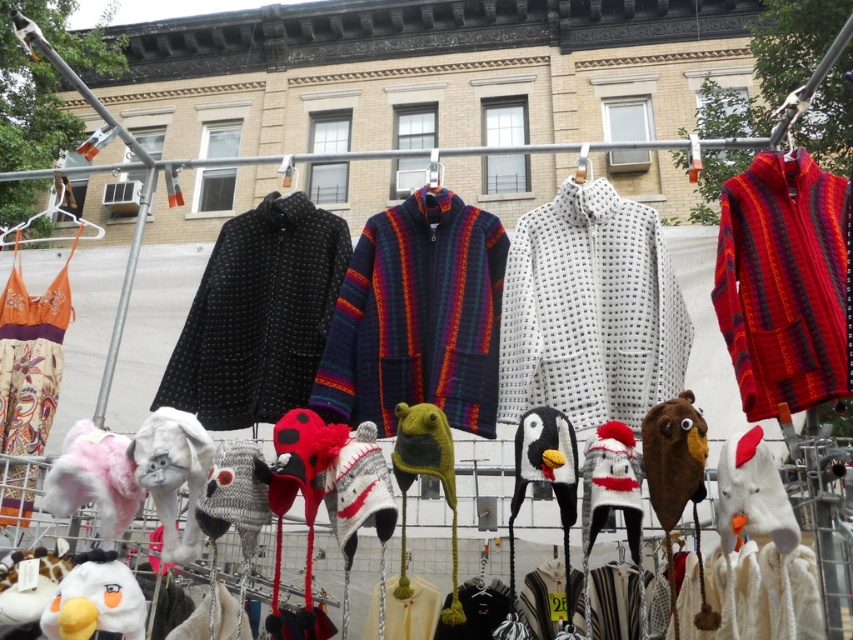
Question: Is brown fuzzy bear at center closer to the viewer compared to knitted wool penguin at center?

Choices:
 (A) yes
 (B) no

Answer: (B)

Question: Which object is positioned closest to the white textured sweater at center?

Choices:
 (A) black dotted fabric coat at center
 (B) knitted wool sweater at center

Answer: (B)

Question: Does black dotted fabric coat at center have a larger size compared to white plush dog at lower left?

Choices:
 (A) no
 (B) yes

Answer: (B)

Question: Which of the following is the farthest from the observer?

Choices:
 (A) click(204, 349)
 (B) click(396, 369)
 (C) click(607, 285)

Answer: (A)

Question: Observing the image, what is the correct spatial positioning of knitted wool sweater at center in reference to black dotted fabric coat at center?

Choices:
 (A) above
 (B) below

Answer: (A)

Question: Which object appears farthest from the camera in this image?

Choices:
 (A) knitted wool sweater at center
 (B) white plush chicken at lower right

Answer: (A)